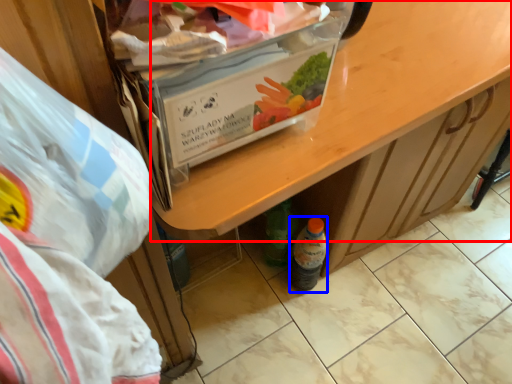
Question: Which object appears farthest to the camera in this image, desk (highlighted by a red box) or bottle (highlighted by a blue box)?

Choices:
 (A) desk
 (B) bottle

Answer: (B)